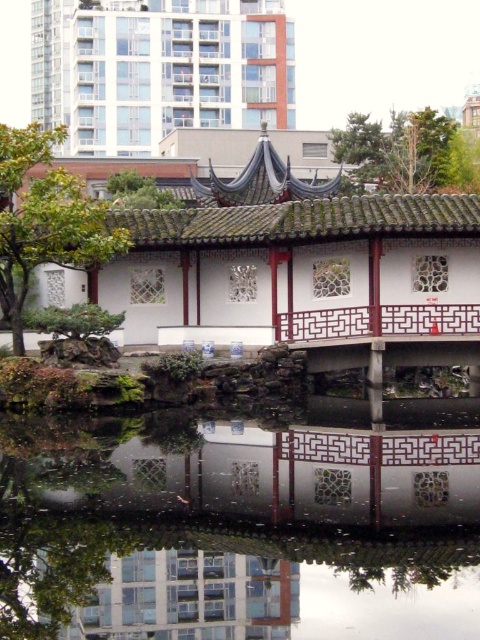
You are a visitor standing in front of the pavilion. You notice the transparent glass water at center and the green leafy tree at upper right. Which object is casting a reflection on the pond?

The green leafy tree at upper right is casting a reflection on the pond because the transparent glass water at center is positioned under it, meaning the tree is above the water and its reflection would appear on the pond.